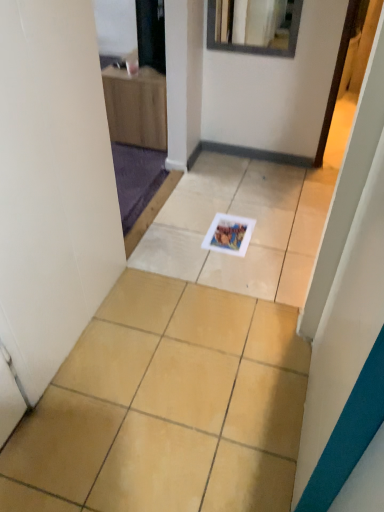
What is the approximate width of beige ceramic tile at center?

7.10 feet.

This screenshot has height=512, width=384. What do you see at coordinates (167, 407) in the screenshot? I see `beige ceramic tile at center` at bounding box center [167, 407].

The image size is (384, 512). I want to click on beige ceramic tile at center, so click(167, 407).

Find the location of `white glossy magazine at center`. white glossy magazine at center is located at coordinates (229, 234).

Measure the distance between white glossy magazine at center and camera.

white glossy magazine at center is 6.36 feet away from camera.

Describe the element at coordinates (229, 234) in the screenshot. I see `white glossy magazine at center` at that location.

The image size is (384, 512). I want to click on beige ceramic tile at center, so click(x=167, y=407).

Considering the positions of objects white glossy magazine at center and beige ceramic tile at center in the image provided, who is more to the left, white glossy magazine at center or beige ceramic tile at center?

From the viewer's perspective, beige ceramic tile at center appears more on the left side.

Is white glossy magazine at center closer to the viewer compared to beige ceramic tile at center?

No, white glossy magazine at center is behind beige ceramic tile at center.

Considering the positions of points (237, 255) and (6, 496), is point (237, 255) farther from camera compared to point (6, 496)?

Yes, it is behind point (6, 496).

From the image's perspective, which is above, white glossy magazine at center or beige ceramic tile at center?

From the image's view, white glossy magazine at center is above.

From a real-world perspective, between white glossy magazine at center and beige ceramic tile at center, who is vertically higher?

white glossy magazine at center is physically above.

Is white glossy magazine at center wider than beige ceramic tile at center?

Incorrect, the width of white glossy magazine at center does not surpass that of beige ceramic tile at center.

Does white glossy magazine at center have a lesser height compared to beige ceramic tile at center?

Yes, white glossy magazine at center is shorter than beige ceramic tile at center.

Which of these two, white glossy magazine at center or beige ceramic tile at center, is smaller?

white glossy magazine at center.

Is beige ceramic tile at center surrounded by white glossy magazine at center?

No.

Is white glossy magazine at center next to beige ceramic tile at center?

They are not placed beside each other.

Is white glossy magazine at center aimed at beige ceramic tile at center?

Yes, white glossy magazine at center is facing beige ceramic tile at center.

How different are the orientations of white glossy magazine at center and beige ceramic tile at center in degrees?

The angle between the facing direction of white glossy magazine at center and the facing direction of beige ceramic tile at center is 180 degrees.

Where is `ceramic tile located on the left of white glossy magazine at center`? The height and width of the screenshot is (512, 384). ceramic tile located on the left of white glossy magazine at center is located at coordinates (167, 407).

Which object is positioned more to the right, beige ceramic tile at center or white glossy magazine at center?

white glossy magazine at center.

Considering the positions of objects beige ceramic tile at center and white glossy magazine at center in the image provided, who is in front, beige ceramic tile at center or white glossy magazine at center?

beige ceramic tile at center is closer to the camera.

Considering the points (196, 300) and (215, 216), which point is in front, point (196, 300) or point (215, 216)?

The point (196, 300) is in front.

From the image's perspective, does beige ceramic tile at center appear lower than white glossy magazine at center?

Yes, from the image's perspective, beige ceramic tile at center is below white glossy magazine at center.

From a real-world perspective, who is located lower, beige ceramic tile at center or white glossy magazine at center?

beige ceramic tile at center.

Considering the sizes of beige ceramic tile at center and white glossy magazine at center in the image, is beige ceramic tile at center wider or thinner than white glossy magazine at center?

Clearly, beige ceramic tile at center has more width compared to white glossy magazine at center.

In terms of height, does beige ceramic tile at center look taller or shorter compared to white glossy magazine at center?

beige ceramic tile at center is taller than white glossy magazine at center.

Which of these two, beige ceramic tile at center or white glossy magazine at center, is bigger?

beige ceramic tile at center is bigger.

Is beige ceramic tile at center completely or partially outside of white glossy magazine at center?

Yes, beige ceramic tile at center is outside of white glossy magazine at center.

Is beige ceramic tile at center in contact with white glossy magazine at center?

No, beige ceramic tile at center is not beside white glossy magazine at center.

Is beige ceramic tile at center oriented away from white glossy magazine at center?

No, beige ceramic tile at center is not facing the opposite direction of white glossy magazine at center.

What's the angular difference between beige ceramic tile at center and white glossy magazine at center's facing directions?

They differ by 180 degrees in their facing directions.

What are the coordinates of `ceramic tile lying in front of the white glossy magazine at center` in the screenshot? It's located at (167, 407).

At what (x,y) coordinates should I click in order to perform the action: click on magazine on the right of the beige ceramic tile at center. Please return your answer as a coordinate pair (x, y). This screenshot has height=512, width=384. Looking at the image, I should click on point(229,234).

This screenshot has height=512, width=384. What are the coordinates of `ceramic tile on the left of white glossy magazine at center` in the screenshot? It's located at (167, 407).